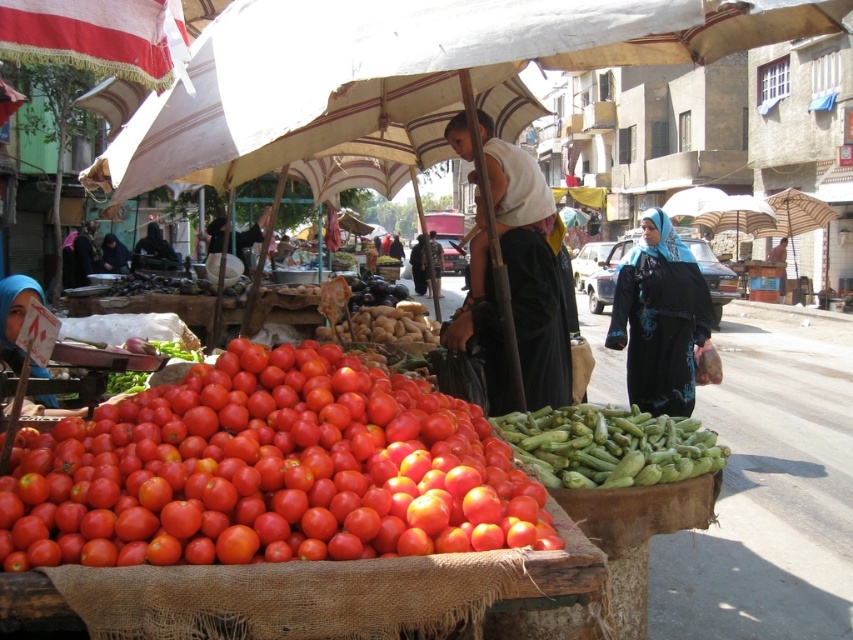
You are a customer at the market and want to buy both the shiny red tomatoes at lower left and the matte blue hijab at lower left. Which item takes up more space on the stall?

The matte blue hijab at lower left occupies more space than the shiny red tomatoes at lower left.

You are a customer at the market and want to buy both the shiny red tomatoes at lower left and the black fabric headscarf at right. If you place them side by side in your basket, which item will take up more space horizontally?

The shiny red tomatoes at lower left will take up more space horizontally because their width is larger than the black fabric headscarf at right.

You are a customer at the market and want to pick up the shiny red tomatoes at lower left. However, there is a black fabric headscarf at right above it. Can you easily access the tomatoes without moving the headscarf?

The shiny red tomatoes at lower left is positioned under the black fabric headscarf at right, so you can easily access the tomatoes without needing to move the headscarf as they are directly underneath.